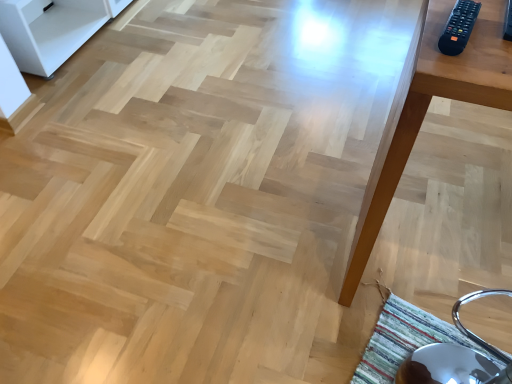
Locate an element on the screen. This screenshot has width=512, height=384. vacant area situated below light brown wood table at right (from a real-world perspective) is located at coordinates (429, 259).